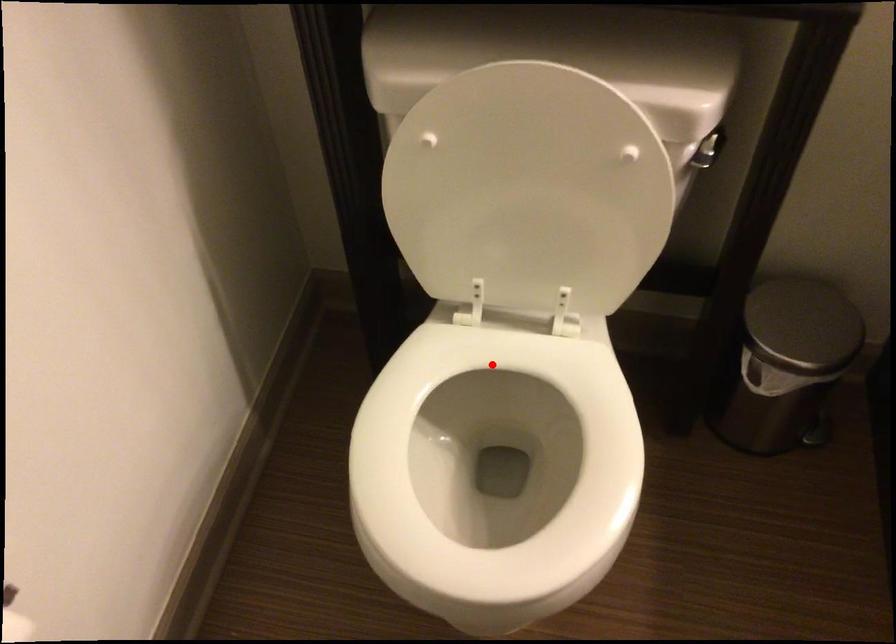
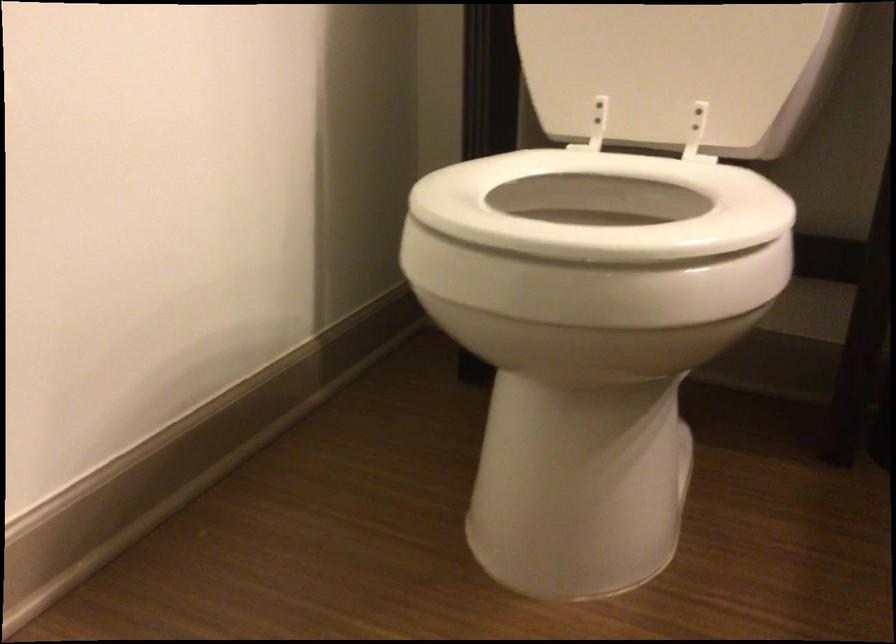
The point at the highlighted location is marked in the first image. Where is the corresponding point in the second image?

(602, 205)